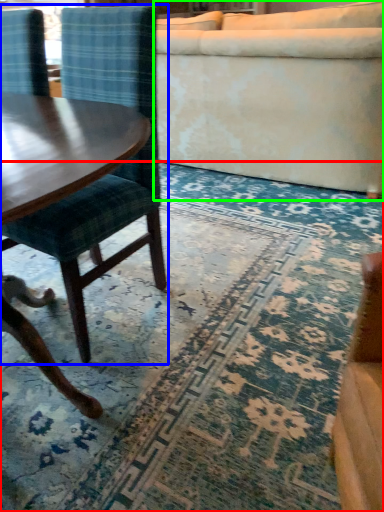
Question: Estimate the real-world distances between objects in this image. Which object is farther from mat (highlighted by a red box), chair (highlighted by a blue box) or studio couch (highlighted by a green box)?

Choices:
 (A) chair
 (B) studio couch

Answer: (B)